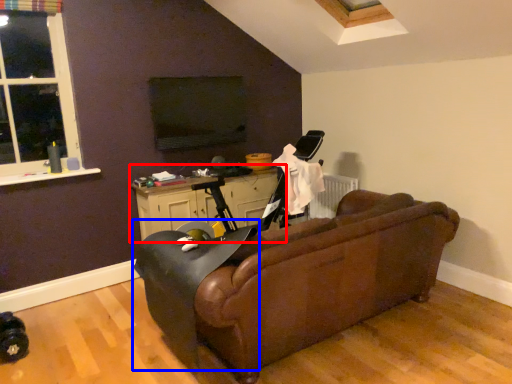
Question: Which object appears farthest to the camera in this image, table (highlighted by a red box) or swivel chair (highlighted by a blue box)?

Choices:
 (A) table
 (B) swivel chair

Answer: (A)